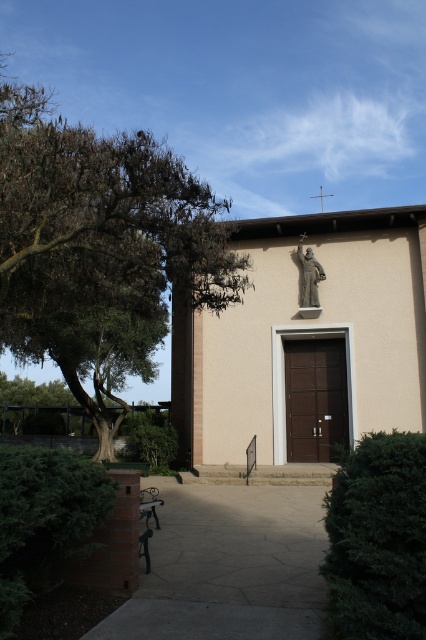
Question: Is green leafy tree at left to the left of wooden park bench at center from the viewer's perspective?

Choices:
 (A) yes
 (B) no

Answer: (A)

Question: Which is farther from the gray stone statue at upper center?

Choices:
 (A) wooden park bench at center
 (B) beige stucco church at center

Answer: (A)

Question: Does beige stucco church at center appear under green leafy tree at left?

Choices:
 (A) no
 (B) yes

Answer: (B)

Question: Estimate the real-world distances between objects in this image. Which object is closer to the gray stone statue at upper center?

Choices:
 (A) wooden park bench at center
 (B) green leafy tree at left
 (C) beige stucco church at center

Answer: (C)

Question: Is green leafy tree at left wider than gray stone statue at upper center?

Choices:
 (A) yes
 (B) no

Answer: (A)

Question: Which of these objects is positioned closest to the beige stucco church at center?

Choices:
 (A) gray stone statue at upper center
 (B) wooden park bench at center

Answer: (A)